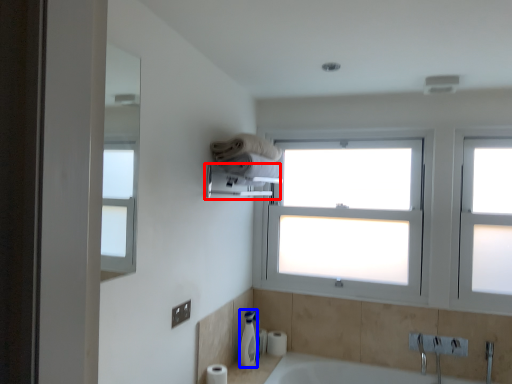
Question: Which object appears closest to the camera in this image, towel bar (highlighted by a red box) or soap dispenser (highlighted by a blue box)?

Choices:
 (A) towel bar
 (B) soap dispenser

Answer: (A)